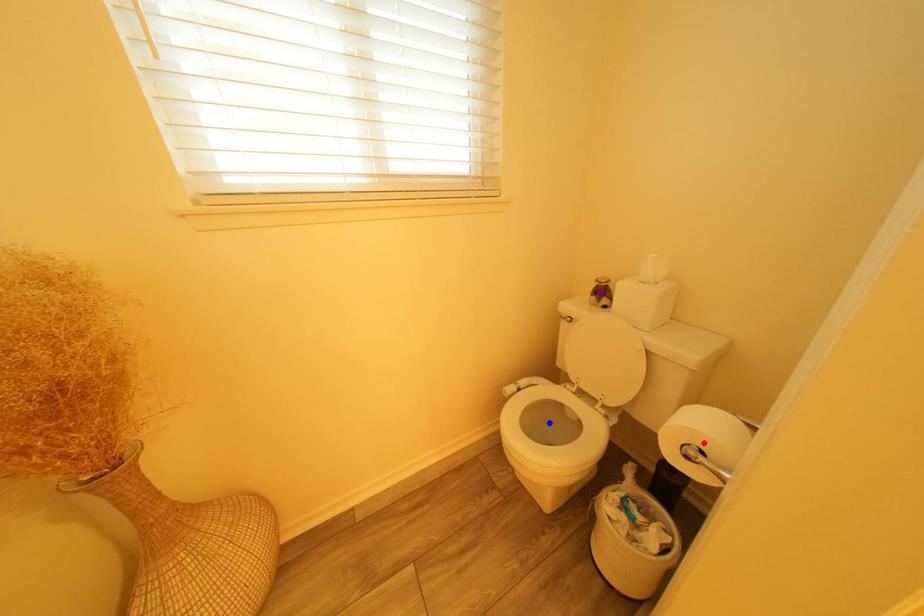
Order these from nearest to farthest:
A) red point
B) blue point
C) purple point

red point → blue point → purple point